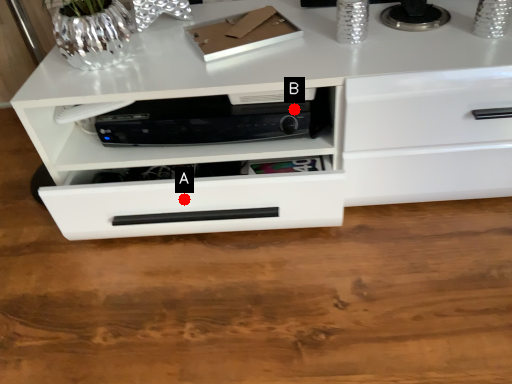
Question: Two points are circled on the image, labeled by A and B beside each circle. Which point is farther from the camera taking this photo?

Choices:
 (A) A is further
 (B) B is further

Answer: (A)